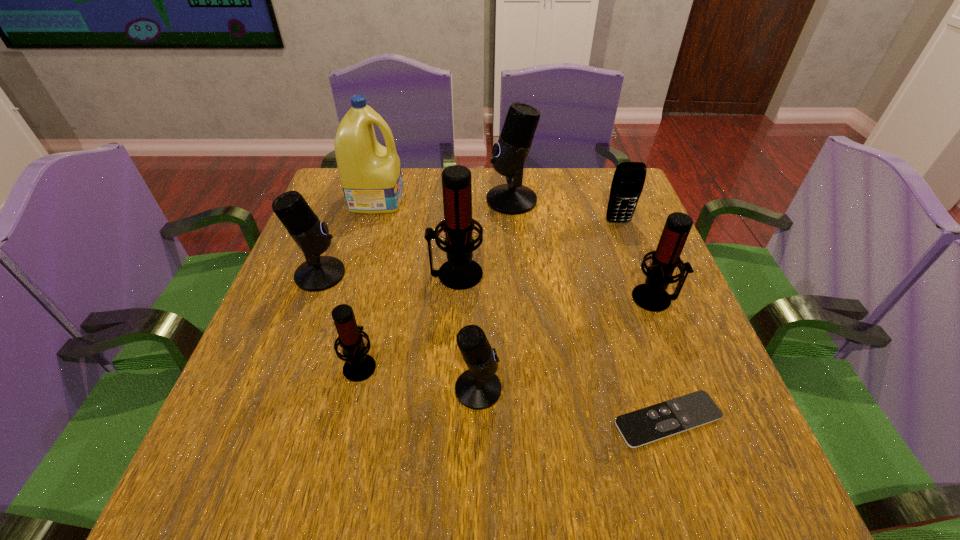
Find the location of a particular element. The image size is (960, 540). cellular telephone that is at the right edge is located at coordinates (628, 181).

You are a GUI agent. You are given a task and a screenshot of the screen. Output one action in this format:
    pyautogui.click(x=<x>, y=<y>)
    Task: Click on the remote control present at the right edge
    
    Given the screenshot: What is the action you would take?
    pyautogui.click(x=674, y=416)

This screenshot has height=540, width=960. I want to click on object that is at the far left corner, so click(x=370, y=174).

Locate an element on the screen. This screenshot has height=540, width=960. free location at the far edge of the desktop is located at coordinates (526, 174).

In the image, there is a desktop. What are the coordinates of `vacant space at the near edge` in the screenshot? It's located at (516, 490).

In the image, there is a desktop. At what (x,y) coordinates should I click in order to perform the action: click on free space at the left edge. Please return your answer as a coordinate pair (x, y). Image resolution: width=960 pixels, height=540 pixels. Looking at the image, I should click on (292, 280).

Where is `vacant region at the right edge of the desktop`? The image size is (960, 540). vacant region at the right edge of the desktop is located at coordinates (644, 256).

The image size is (960, 540). What are the coordinates of `blank space at the far left corner of the desktop` in the screenshot? It's located at click(x=332, y=189).

In the image, there is a desktop. Identify the location of vacant space at the near left corner. The width and height of the screenshot is (960, 540). (284, 469).

The width and height of the screenshot is (960, 540). In the image, there is a desktop. Identify the location of free space at the far right corner. (596, 169).